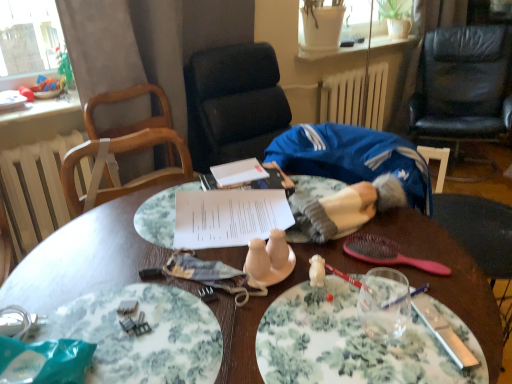
Locate an element on the screen. This screenshot has width=512, height=384. vacant space situated on the left part of white paper at center is located at coordinates (108, 240).